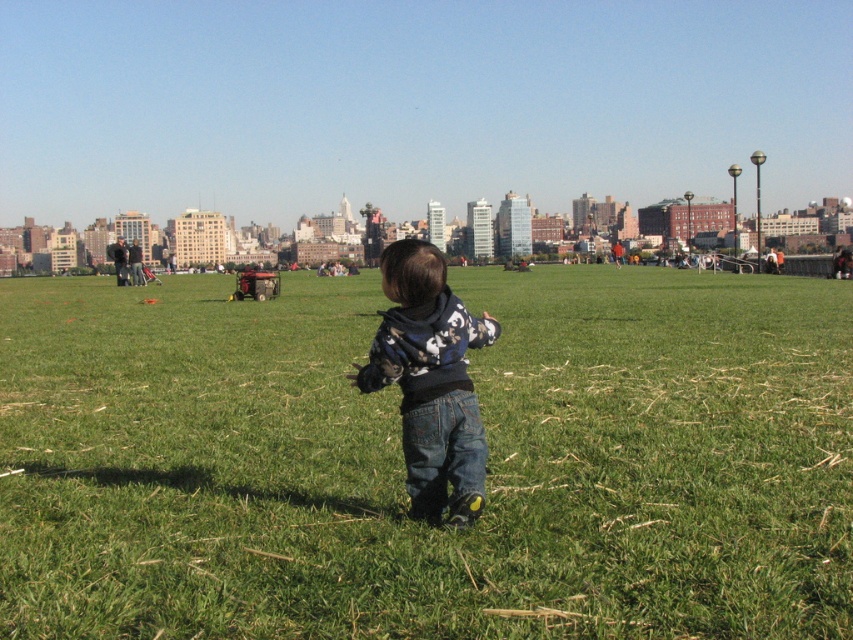
You are a drone operator trying to capture a photo of the child in the scene. The green grass at center and denim pants at center are both in your camera view. How far apart are these two objects in feet?

The distance between the green grass at center and denim pants at center is 89.51 feet.

You are a photographer trying to capture a clear shot of the city skyline in the background. You notice the green grass at center and the denim pants at center are blocking your view. Which object should you move closer to the camera to ensure the skyline remains visible?

To ensure the skyline remains visible, you should move the green grass at center closer to the camera since it is already closer than the denim pants at center, allowing the denim pants at center to be in the background without obstruction.

You are a photographer trying to capture a clear shot of the city skyline in the background. You notice the green grass at center and denim pants at center are blocking your view. Which object should you move to get a better view of the skyline?

The green grass at center is bigger than the denim pants at center, so moving the green grass at center would provide a clearer view of the skyline since it is larger and more obstructive.